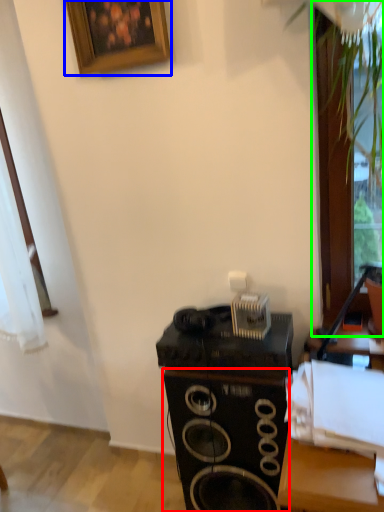
Question: Which object is positioned closest to speaker (highlighted by a red box)? Select from picture frame (highlighted by a blue box) and glass door (highlighted by a green box).

Choices:
 (A) picture frame
 (B) glass door

Answer: (B)